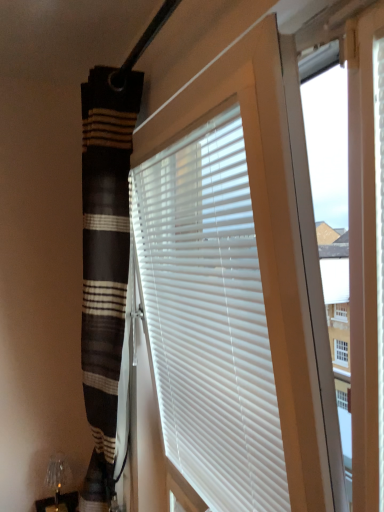
Question: Should I look upward or downward to see metallic silver table lamp at lower left?

Choices:
 (A) down
 (B) up

Answer: (A)

Question: Is metallic silver table lamp at lower left positioned beyond the bounds of white matte blinds at center?

Choices:
 (A) yes
 (B) no

Answer: (A)

Question: From the image's perspective, is metallic silver table lamp at lower left over white matte blinds at center?

Choices:
 (A) yes
 (B) no

Answer: (B)

Question: From a real-world perspective, is metallic silver table lamp at lower left over white matte blinds at center?

Choices:
 (A) yes
 (B) no

Answer: (B)

Question: Can you confirm if metallic silver table lamp at lower left is taller than white matte blinds at center?

Choices:
 (A) no
 (B) yes

Answer: (A)

Question: Does metallic silver table lamp at lower left appear on the left side of white matte blinds at center?

Choices:
 (A) no
 (B) yes

Answer: (B)

Question: Does metallic silver table lamp at lower left come behind white matte blinds at center?

Choices:
 (A) yes
 (B) no

Answer: (A)

Question: Considering the relative sizes of white matte blinds at center and metallic silver table lamp at lower left in the image provided, is white matte blinds at center smaller than metallic silver table lamp at lower left?

Choices:
 (A) yes
 (B) no

Answer: (B)

Question: Is white matte blinds at center shorter than metallic silver table lamp at lower left?

Choices:
 (A) no
 (B) yes

Answer: (A)

Question: Considering the relative sizes of white matte blinds at center and metallic silver table lamp at lower left in the image provided, is white matte blinds at center thinner than metallic silver table lamp at lower left?

Choices:
 (A) yes
 (B) no

Answer: (A)

Question: Is metallic silver table lamp at lower left at the back of white matte blinds at center?

Choices:
 (A) no
 (B) yes

Answer: (A)

Question: From the image's perspective, is white matte blinds at center under metallic silver table lamp at lower left?

Choices:
 (A) yes
 (B) no

Answer: (B)

Question: From a real-world perspective, is white matte blinds at center on metallic silver table lamp at lower left?

Choices:
 (A) no
 (B) yes

Answer: (B)

Question: From the image's perspective, is metallic silver table lamp at lower left located above or below white matte blinds at center?

Choices:
 (A) below
 (B) above

Answer: (A)